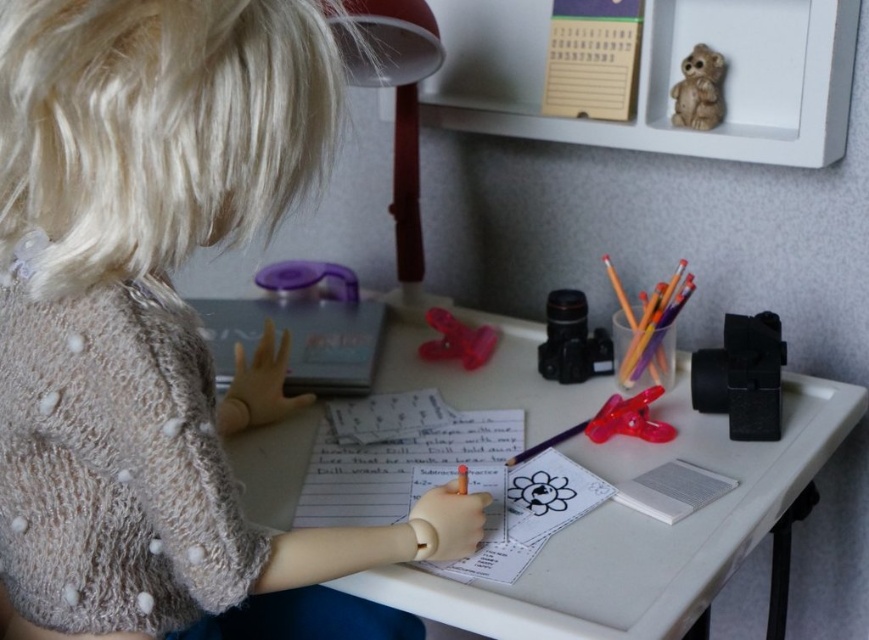
You are a photographer trying to capture the doll at the desk. The knitted beige sweater at center is located at point [158,323]. If you want to focus on the sweater, which object on the desk should you avoid blocking the view of the sweater with?

The knitted beige sweater at center is represented by point [158,323]. To avoid blocking the view of the sweater, you should ensure that the two cameras placed side by side on the right do not obstruct the line of sight to the sweater.

You need to place a sticker on the widest paper available on the desk. Which one should you choose between the white paper at center and the white paper notepad at right?

The white paper at center is wider than the white paper notepad at right, so you should choose the white paper at center.

You are organizing a desk and need to place a new item between the white paper at center and the transparent plastic clip at center. Which object should you place the item closer to if you want it to be near the larger object?

You should place the item closer to the white paper at center because it is larger than the transparent plastic clip at center.